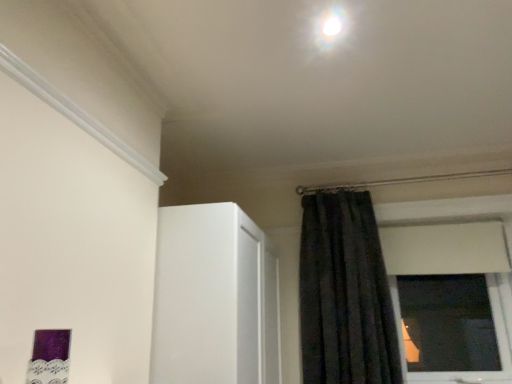
Question: Is white glossy light at upper center not near black velvet curtain at upper right?

Choices:
 (A) yes
 (B) no

Answer: (A)

Question: Considering the relative positions of white glossy light at upper center and black velvet curtain at upper right in the image provided, is white glossy light at upper center to the left of black velvet curtain at upper right from the viewer's perspective?

Choices:
 (A) yes
 (B) no

Answer: (A)

Question: Can you confirm if white glossy light at upper center is bigger than black velvet curtain at upper right?

Choices:
 (A) no
 (B) yes

Answer: (A)

Question: Considering the relative sizes of white glossy light at upper center and black velvet curtain at upper right in the image provided, is white glossy light at upper center taller than black velvet curtain at upper right?

Choices:
 (A) no
 (B) yes

Answer: (A)

Question: Could you tell me if white glossy light at upper center is turned towards black velvet curtain at upper right?

Choices:
 (A) yes
 (B) no

Answer: (B)

Question: From the image's perspective, does white glossy light at upper center appear lower than black velvet curtain at upper right?

Choices:
 (A) no
 (B) yes

Answer: (A)

Question: From the image's perspective, does black velvet curtain at upper right appear lower than white glossy light at upper center?

Choices:
 (A) yes
 (B) no

Answer: (A)

Question: From the image's perspective, is black velvet curtain at upper right over white glossy light at upper center?

Choices:
 (A) yes
 (B) no

Answer: (B)

Question: Does black velvet curtain at upper right lie behind white glossy light at upper center?

Choices:
 (A) no
 (B) yes

Answer: (B)

Question: From a real-world perspective, is black velvet curtain at upper right positioned over white glossy light at upper center based on gravity?

Choices:
 (A) no
 (B) yes

Answer: (A)

Question: Is black velvet curtain at upper right thinner than white glossy light at upper center?

Choices:
 (A) no
 (B) yes

Answer: (A)

Question: Is black velvet curtain at upper right smaller than white glossy light at upper center?

Choices:
 (A) yes
 (B) no

Answer: (B)

Question: Looking at the image, does black velvet curtain at upper right seem bigger or smaller compared to white glossy light at upper center?

Choices:
 (A) small
 (B) big

Answer: (B)